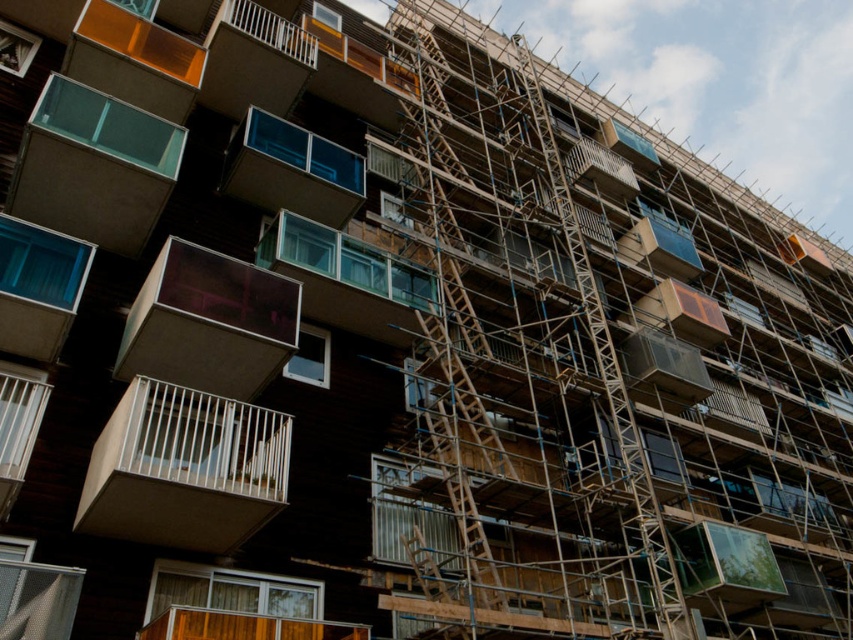
You are an architect inspecting the construction site. You notice the wooden scaffolding at center and the translucent glass balcony at center. Which object is located to the right of the other?

The wooden scaffolding at center is positioned on the right side of the translucent glass balcony at center, so the wooden scaffolding at center is to the right of the translucent glass balcony at center.

You are an architect inspecting the construction site of a residential building. You notice the white matte balcony at center and the wooden scaffolding at center. Which of these two objects has a smaller width?

The white matte balcony at center is thinner than the wooden scaffolding at center, so the white matte balcony at center has a smaller width.

Looking at this image, you are a construction worker standing at the camera position. You need to reach the white matte balcony at center to inspect its railings. Can you safely walk directly to it without using any equipment?

The distance between the white matte balcony at center and the camera is 105.43 feet, so you cannot safely walk directly to it without equipment as the distance is too large.